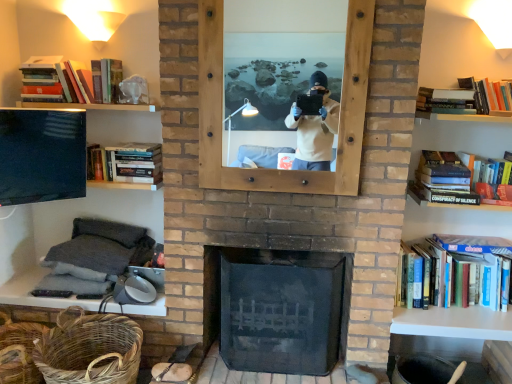
Question: Is hardcover book at right, which appears as the 1th book when ordered from the bottom, at the right side of hardcover book at upper right, the fourth book ordered from the bottom?

Choices:
 (A) no
 (B) yes

Answer: (A)

Question: Is hardcover book at right, which appears as the fifth book when viewed from the top, thinner than hardcover book at upper right, the fourth book ordered from the bottom?

Choices:
 (A) no
 (B) yes

Answer: (A)

Question: Can you confirm if hardcover book at right, which appears as the 1th book when ordered from the bottom, is smaller than hardcover book at upper right, the fourth book ordered from the bottom?

Choices:
 (A) yes
 (B) no

Answer: (B)

Question: Is hardcover book at right, acting as the fourth book starting from the left, closer to camera compared to hardcover book at upper right, placed as the fifth book when sorted from left to right?

Choices:
 (A) no
 (B) yes

Answer: (A)

Question: Does hardcover book at right, acting as the second book starting from the right, have a larger size compared to hardcover book at upper right, arranged as the 2th book when viewed from the top?

Choices:
 (A) yes
 (B) no

Answer: (A)

Question: From a real-world perspective, is hardcover book at right, which appears as the fifth book when viewed from the top, physically below hardcover book at upper right, arranged as the 2th book when viewed from the top?

Choices:
 (A) no
 (B) yes

Answer: (B)

Question: Considering the relative sizes of matte black tv at left and hardcover book at right, acting as the fourth book starting from the left, in the image provided, is matte black tv at left shorter than hardcover book at right, acting as the fourth book starting from the left,?

Choices:
 (A) no
 (B) yes

Answer: (B)

Question: Is matte black tv at left surrounding hardcover book at right, which appears as the fifth book when viewed from the top?

Choices:
 (A) yes
 (B) no

Answer: (B)

Question: From a real-world perspective, does matte black tv at left sit lower than hardcover book at right, acting as the second book starting from the right?

Choices:
 (A) yes
 (B) no

Answer: (B)

Question: Does matte black tv at left have a greater width compared to hardcover book at right, acting as the fourth book starting from the left?

Choices:
 (A) no
 (B) yes

Answer: (A)

Question: Is matte black tv at left thinner than hardcover book at right, acting as the second book starting from the right?

Choices:
 (A) no
 (B) yes

Answer: (B)

Question: From the image's perspective, is matte black tv at left above hardcover book at right, which appears as the 1th book when ordered from the bottom?

Choices:
 (A) yes
 (B) no

Answer: (A)

Question: From a real-world perspective, is hardcover book at left, the third book from the bottom, positioned over dark gray fabric at lower left based on gravity?

Choices:
 (A) no
 (B) yes

Answer: (B)